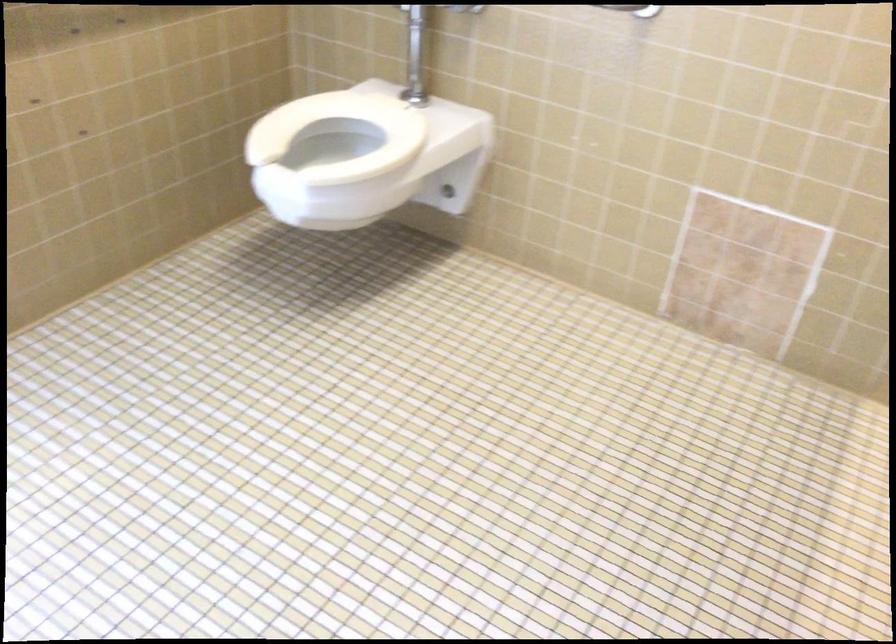
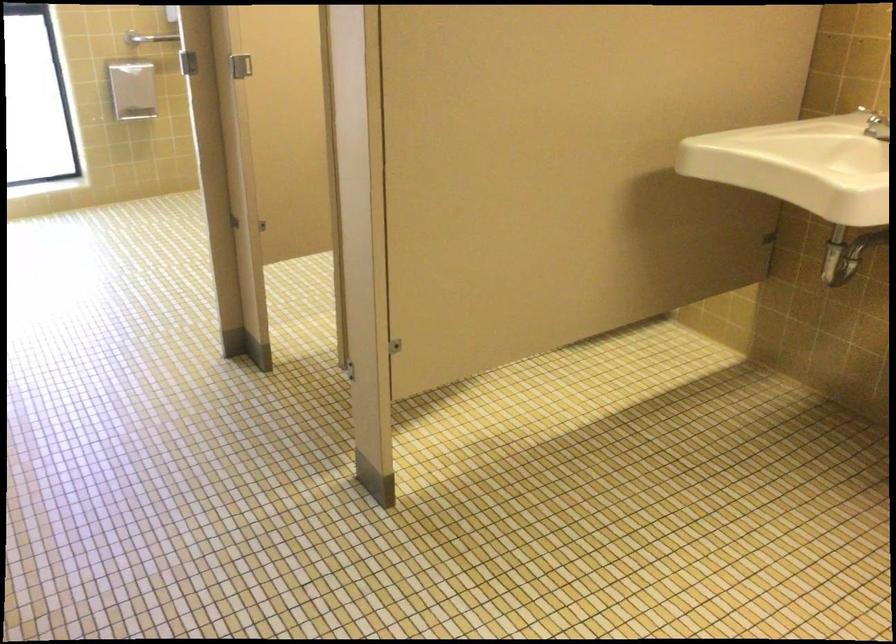
The images are taken continuously from a first-person perspective. In which direction are you moving?

The cameraman walked toward right, backward.